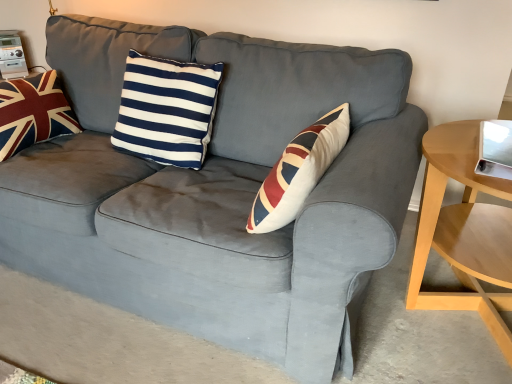
Question: Does velvet union jack pillow at left, placed as the 1th pillow when sorted from left to right, appear on the right side of light wood/woodenobject at right?

Choices:
 (A) no
 (B) yes

Answer: (A)

Question: Considering the relative sizes of velvet union jack pillow at left, which ranks as the second pillow in right-to-left order, and light wood/woodenobject at right in the image provided, is velvet union jack pillow at left, which ranks as the second pillow in right-to-left order, wider than light wood/woodenobject at right?

Choices:
 (A) no
 (B) yes

Answer: (A)

Question: Considering the relative positions of velvet union jack pillow at left, which ranks as the second pillow in right-to-left order, and light wood/woodenobject at right in the image provided, is velvet union jack pillow at left, which ranks as the second pillow in right-to-left order, to the left of light wood/woodenobject at right from the viewer's perspective?

Choices:
 (A) yes
 (B) no

Answer: (A)

Question: Does velvet union jack pillow at left, placed as the 1th pillow when sorted from left to right, have a smaller size compared to light wood/woodenobject at right?

Choices:
 (A) no
 (B) yes

Answer: (B)

Question: From the image's perspective, is velvet union jack pillow at left, placed as the 1th pillow when sorted from left to right, located beneath light wood/woodenobject at right?

Choices:
 (A) yes
 (B) no

Answer: (B)

Question: Is velvet union jack pillow at left, placed as the 1th pillow when sorted from left to right, next to light wood/woodenobject at right and touching it?

Choices:
 (A) yes
 (B) no

Answer: (B)

Question: Can you confirm if navy/white striped cushion at center, which ranks as the second pillow in left-to-right order, is positioned to the right of velvet union jack pillow at left, which ranks as the second pillow in right-to-left order?

Choices:
 (A) no
 (B) yes

Answer: (B)

Question: Does navy/white striped cushion at center, which ranks as the second pillow in left-to-right order, turn towards velvet union jack pillow at left, which ranks as the second pillow in right-to-left order?

Choices:
 (A) no
 (B) yes

Answer: (A)

Question: From the image's perspective, is navy/white striped cushion at center, which ranks as the second pillow in left-to-right order, on top of velvet union jack pillow at left, placed as the 1th pillow when sorted from left to right?

Choices:
 (A) no
 (B) yes

Answer: (A)

Question: From a real-world perspective, is navy/white striped cushion at center, the 1th pillow positioned from the right, below velvet union jack pillow at left, which ranks as the second pillow in right-to-left order?

Choices:
 (A) no
 (B) yes

Answer: (A)

Question: Can you confirm if navy/white striped cushion at center, which ranks as the second pillow in left-to-right order, is smaller than velvet union jack pillow at left, placed as the 1th pillow when sorted from left to right?

Choices:
 (A) no
 (B) yes

Answer: (A)

Question: From the image's perspective, is navy/white striped cushion at center, the 1th pillow positioned from the right, below velvet union jack pillow at left, placed as the 1th pillow when sorted from left to right?

Choices:
 (A) no
 (B) yes

Answer: (B)

Question: Is the position of light wood/woodenobject at right more distant than that of navy/white striped cushion at center, the 1th pillow positioned from the right?

Choices:
 (A) no
 (B) yes

Answer: (A)